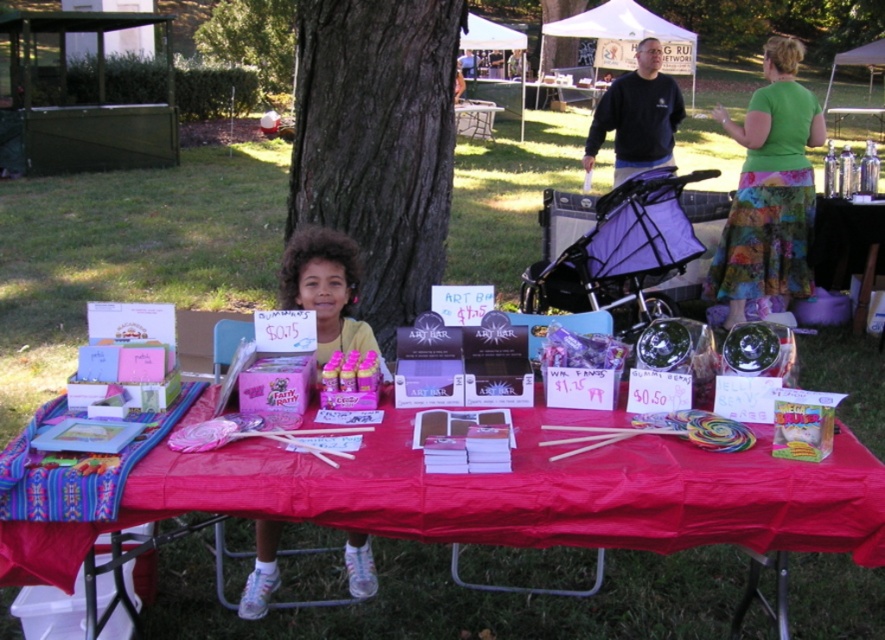
Does matte pink tablecloth at center have a larger size compared to green leafy tree at upper left?

Actually, matte pink tablecloth at center might be smaller than green leafy tree at upper left.

Does matte pink tablecloth at center appear on the left side of green leafy tree at upper left?

In fact, matte pink tablecloth at center is to the right of green leafy tree at upper left.

This screenshot has width=885, height=640. Describe the element at coordinates (573, 536) in the screenshot. I see `matte pink tablecloth at center` at that location.

Where is `matte pink tablecloth at center`? The width and height of the screenshot is (885, 640). matte pink tablecloth at center is located at coordinates (573, 536).

Is matte pink tablecloth at center positioned at the back of brown rough bark tree at center?

No.

How distant is matte pink tablecloth at center from brown rough bark tree at center?

1.82 meters

Measure the distance between matte pink tablecloth at center and camera.

matte pink tablecloth at center and camera are 2.65 meters apart.

I want to click on matte pink tablecloth at center, so click(573, 536).

Is matte yellow shirt at center behind green leafy tree at upper left?

No, it is in front of green leafy tree at upper left.

Can you confirm if matte yellow shirt at center is positioned below green leafy tree at upper left?

Yes.

At what (x,y) coordinates should I click in order to perform the action: click on matte yellow shirt at center. Please return your answer as a coordinate pair (x, y). Looking at the image, I should click on (325, 289).